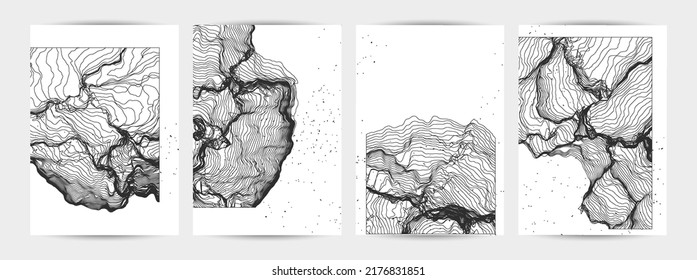
I want to click on space left of pictures, so click(x=10, y=131).